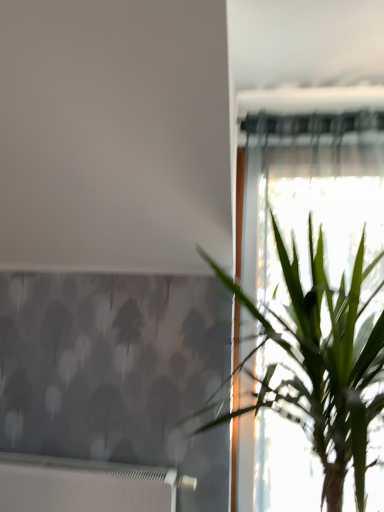
Measure the distance between green leafy plant at upper right and camera.

The depth of green leafy plant at upper right is 3.29 feet.

What do you see at coordinates (320, 365) in the screenshot? This screenshot has width=384, height=512. I see `green leafy plant at upper right` at bounding box center [320, 365].

Identify the location of green leafy plant at upper right. Image resolution: width=384 pixels, height=512 pixels. (320, 365).

I want to click on green leafy plant at upper right, so click(x=320, y=365).